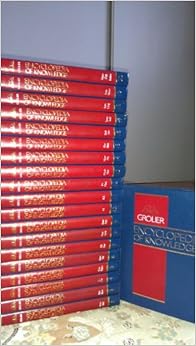
Identify the location of encyclopedia. (156, 232).